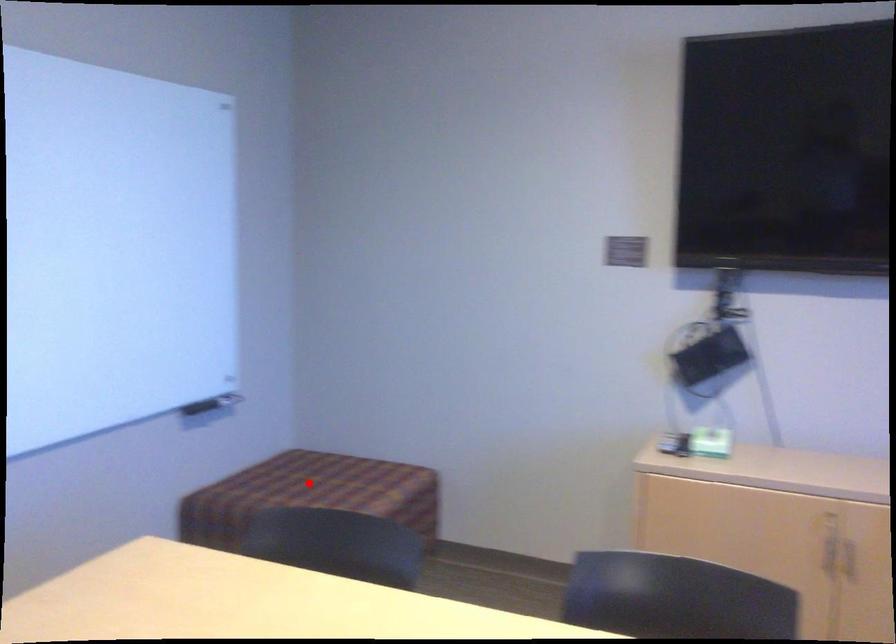
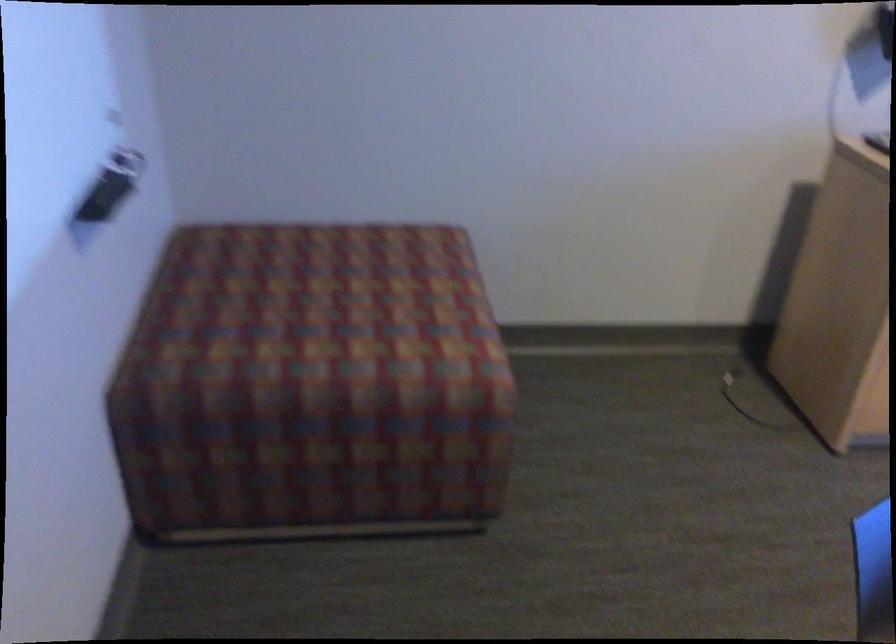
Question: A red point is marked in image1. In image2, is the corresponding 3D point closer to the camera or farther? Reply with the corresponding letter.

Choices:
 (A) The corresponding 3D point is closer.
 (B) The corresponding 3D point is farther.

Answer: (A)